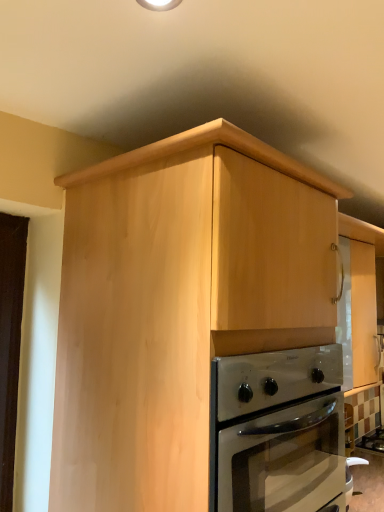
The image size is (384, 512). What do you see at coordinates (178, 305) in the screenshot?
I see `natural wood cabinet at upper center` at bounding box center [178, 305].

The image size is (384, 512). Find the location of `natural wood cabinet at upper center`. natural wood cabinet at upper center is located at coordinates (178, 305).

The image size is (384, 512). Identify the location of natural wood cabinet at upper center. (178, 305).